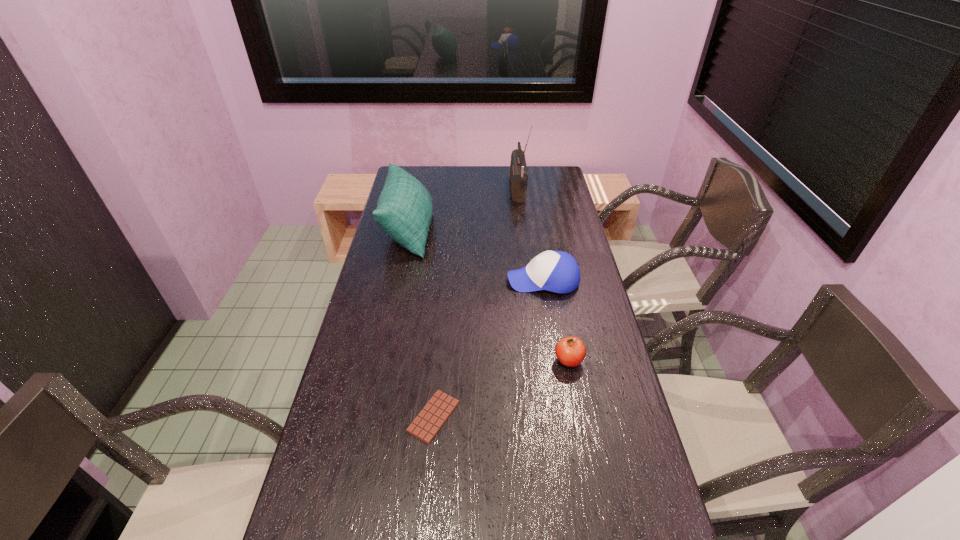
The height and width of the screenshot is (540, 960). I want to click on vacant space that satisfies the following two spatial constraints: 1. on the front-facing side of the baseball cap; 2. on the back side of the fourth farthest object, so click(556, 361).

I want to click on vacant area in the image that satisfies the following two spatial constraints: 1. on the front-facing side of the baseball cap; 2. on the back side of the apple, so click(x=556, y=361).

Locate an element on the screen. Image resolution: width=960 pixels, height=540 pixels. free space that satisfies the following two spatial constraints: 1. on the front-facing side of the second farthest object; 2. on the left side of the second nearest object is located at coordinates pyautogui.click(x=381, y=361).

Identify the location of free spot that satisfies the following two spatial constraints: 1. on the front-facing side of the third nearest object; 2. on the left side of the second nearest object. This screenshot has height=540, width=960. (556, 361).